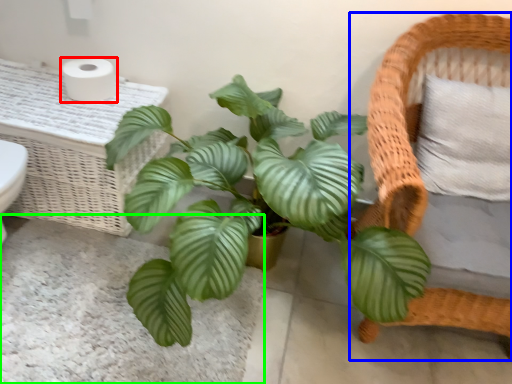
Question: Which object is the farthest from toilet paper (highlighted by a red box)? Choose among these: furniture (highlighted by a blue box) or plain (highlighted by a green box).

Choices:
 (A) furniture
 (B) plain

Answer: (A)